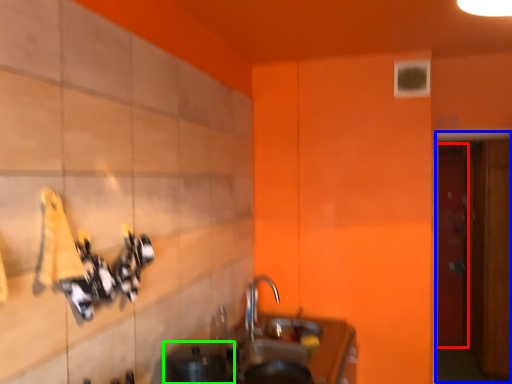
Question: Which object is the farthest from door (highlighted by a red box)? Choose among these: door (highlighted by a blue box) or appliance (highlighted by a green box).

Choices:
 (A) door
 (B) appliance

Answer: (B)